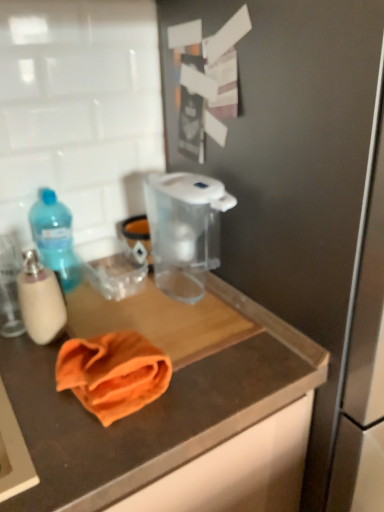
Question: Should I look upward or downward to see orange cloth at center?

Choices:
 (A) up
 (B) down

Answer: (B)

Question: Could you tell me if orange cloth at center is turned towards transparent plastic pitcher at center?

Choices:
 (A) no
 (B) yes

Answer: (A)

Question: From the image's perspective, is orange cloth at center on top of transparent plastic pitcher at center?

Choices:
 (A) no
 (B) yes

Answer: (A)

Question: Can you confirm if orange cloth at center is shorter than transparent plastic pitcher at center?

Choices:
 (A) yes
 (B) no

Answer: (A)

Question: Does orange cloth at center come in front of transparent plastic pitcher at center?

Choices:
 (A) no
 (B) yes

Answer: (B)

Question: Does orange cloth at center have a greater width compared to transparent plastic pitcher at center?

Choices:
 (A) yes
 (B) no

Answer: (B)

Question: Is orange cloth at center taller than transparent plastic pitcher at center?

Choices:
 (A) no
 (B) yes

Answer: (A)

Question: Considering the relative positions of translucent plastic soap dispenser at left, which appears as the second bottle when viewed from the back, and transparent plastic pitcher at center in the image provided, is translucent plastic soap dispenser at left, which appears as the second bottle when viewed from the back, to the left of transparent plastic pitcher at center from the viewer's perspective?

Choices:
 (A) no
 (B) yes

Answer: (B)

Question: Can you confirm if translucent plastic soap dispenser at left, which appears as the second bottle when viewed from the back, is taller than transparent plastic pitcher at center?

Choices:
 (A) no
 (B) yes

Answer: (A)

Question: Is translucent plastic soap dispenser at left, which appears as the second bottle when viewed from the back, closer to the viewer compared to transparent plastic pitcher at center?

Choices:
 (A) yes
 (B) no

Answer: (A)

Question: Can you confirm if translucent plastic soap dispenser at left, acting as the 1th bottle starting from the front, is thinner than transparent plastic pitcher at center?

Choices:
 (A) no
 (B) yes

Answer: (B)

Question: Is translucent plastic soap dispenser at left, acting as the 1th bottle starting from the front, oriented towards transparent plastic pitcher at center?

Choices:
 (A) yes
 (B) no

Answer: (B)

Question: Does translucent plastic soap dispenser at left, acting as the 1th bottle starting from the front, have a lesser height compared to transparent plastic pitcher at center?

Choices:
 (A) no
 (B) yes

Answer: (B)

Question: Does transparent plastic pitcher at center appear on the right side of blue translucent bottle at left, the first bottle when ordered from back to front?

Choices:
 (A) no
 (B) yes

Answer: (B)